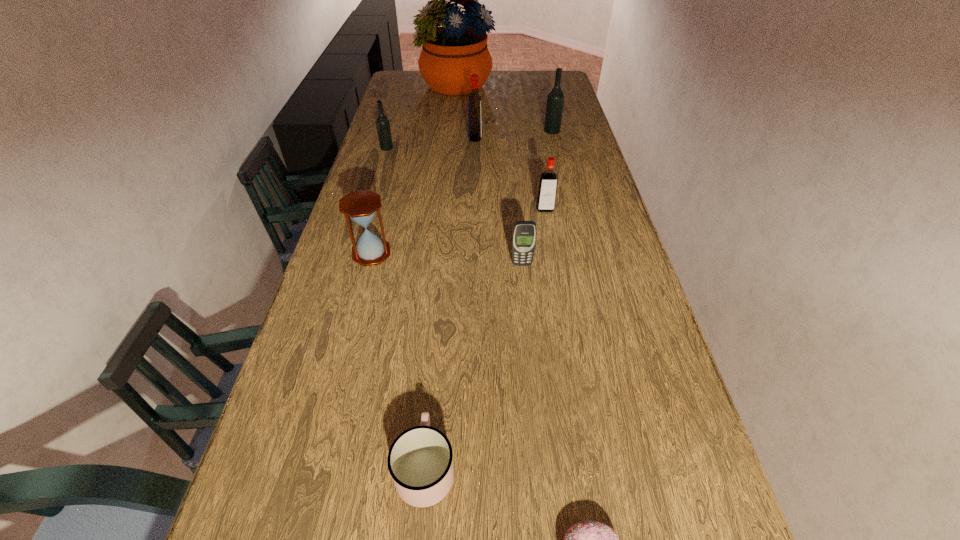
Find the location of a particular element. The image size is (960, 540). vacant space in between the smaller black vodka and the farther red vodka is located at coordinates (431, 143).

Locate an element on the screen. This screenshot has width=960, height=540. free spot between the cellular telephone and the third vodka from right to left is located at coordinates (498, 201).

In order to click on the closest object to the second shortest object in this screenshot , I will do `click(588, 539)`.

I want to click on object that is the seventh closest to the leftmost vodka, so click(420, 462).

Where is `the second closest vodka to the mug`? the second closest vodka to the mug is located at coordinates (382, 122).

The height and width of the screenshot is (540, 960). Identify the location of vodka that is the closest to the left red vodka. (555, 100).

Locate an element on the screen. free spot that satisfies the following two spatial constraints: 1. on the front and back of the third vodka from right to left; 2. on the front side of the hourglass is located at coordinates (473, 253).

In order to click on free location that satisfies the following two spatial constraints: 1. on the front and back of the bigger red vodka; 2. on the front side of the left black vodka in this screenshot , I will do `click(475, 147)`.

Locate an element on the screen. This screenshot has height=540, width=960. vacant space that satisfies the following two spatial constraints: 1. on the side of the bigger black vodka with the handle; 2. on the left side of the eighth farthest object is located at coordinates (454, 131).